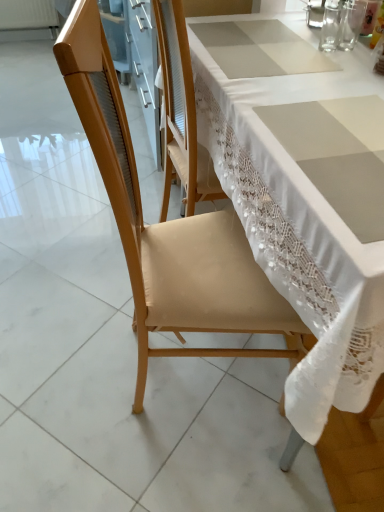
Question: Is transparent glass at upper right, marked as the 3th tableware in a left-to-right arrangement, thinner than transparent glass at upper right, arranged as the 2th tableware when viewed from the right?

Choices:
 (A) no
 (B) yes

Answer: (B)

Question: From a real-world perspective, is transparent glass at upper right, marked as the 3th tableware in a left-to-right arrangement, located higher than transparent glass at upper right, the 2th tableware positioned from the left?

Choices:
 (A) no
 (B) yes

Answer: (B)

Question: Can you confirm if transparent glass at upper right, marked as the 3th tableware in a left-to-right arrangement, is wider than transparent glass at upper right, the 2th tableware positioned from the left?

Choices:
 (A) yes
 (B) no

Answer: (B)

Question: Is transparent glass at upper right, the 1th tableware from the right, oriented towards transparent glass at upper right, arranged as the 2th tableware when viewed from the right?

Choices:
 (A) yes
 (B) no

Answer: (A)

Question: Can you confirm if transparent glass at upper right, marked as the 3th tableware in a left-to-right arrangement, is bigger than transparent glass at upper right, the 2th tableware positioned from the left?

Choices:
 (A) yes
 (B) no

Answer: (B)

Question: Considering the relative sizes of transparent glass at upper right, marked as the 3th tableware in a left-to-right arrangement, and transparent glass at upper right, arranged as the 2th tableware when viewed from the right, in the image provided, is transparent glass at upper right, marked as the 3th tableware in a left-to-right arrangement, taller than transparent glass at upper right, arranged as the 2th tableware when viewed from the right,?

Choices:
 (A) no
 (B) yes

Answer: (B)

Question: From a real-world perspective, is clear glass at upper right, which appears as the 3th tableware when viewed from the right, positioned under transparent glass at upper right, marked as the 3th tableware in a left-to-right arrangement, based on gravity?

Choices:
 (A) no
 (B) yes

Answer: (A)

Question: Would you say clear glass at upper right, acting as the first tableware starting from the left, is a long distance from transparent glass at upper right, marked as the 3th tableware in a left-to-right arrangement?

Choices:
 (A) yes
 (B) no

Answer: (B)

Question: Considering the relative sizes of clear glass at upper right, acting as the first tableware starting from the left, and transparent glass at upper right, marked as the 3th tableware in a left-to-right arrangement, in the image provided, is clear glass at upper right, acting as the first tableware starting from the left, taller than transparent glass at upper right, marked as the 3th tableware in a left-to-right arrangement,?

Choices:
 (A) no
 (B) yes

Answer: (B)

Question: Can you confirm if clear glass at upper right, which appears as the 3th tableware when viewed from the right, is positioned to the left of transparent glass at upper right, the 1th tableware from the right?

Choices:
 (A) no
 (B) yes

Answer: (B)

Question: From a real-world perspective, is clear glass at upper right, which appears as the 3th tableware when viewed from the right, positioned over transparent glass at upper right, marked as the 3th tableware in a left-to-right arrangement, based on gravity?

Choices:
 (A) yes
 (B) no

Answer: (A)

Question: Is clear glass at upper right, which appears as the 3th tableware when viewed from the right, with transparent glass at upper right, marked as the 3th tableware in a left-to-right arrangement?

Choices:
 (A) no
 (B) yes

Answer: (B)

Question: From the image's perspective, is transparent glass at upper right, the 2th tableware positioned from the left, beneath transparent glass at upper right, marked as the 3th tableware in a left-to-right arrangement?

Choices:
 (A) no
 (B) yes

Answer: (B)